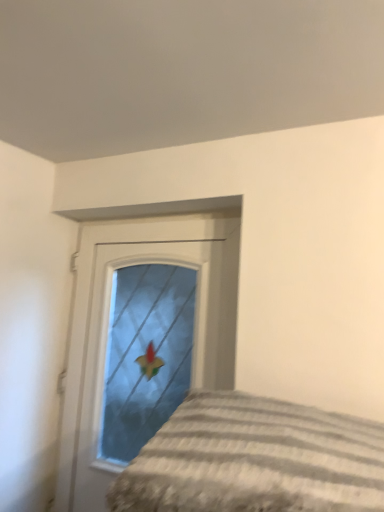
Image resolution: width=384 pixels, height=512 pixels. What do you see at coordinates (108, 323) in the screenshot? I see `matte glass door at center` at bounding box center [108, 323].

The image size is (384, 512). I want to click on matte glass door at center, so click(x=108, y=323).

What do you see at coordinates (254, 459) in the screenshot? The width and height of the screenshot is (384, 512). I see `striped fabric bed at lower right` at bounding box center [254, 459].

Where is `striped fabric bed at lower right`? Image resolution: width=384 pixels, height=512 pixels. striped fabric bed at lower right is located at coordinates (254, 459).

Where is `matte glass door at center`? matte glass door at center is located at coordinates (108, 323).

Does matte glass door at center appear on the right side of striped fabric bed at lower right?

In fact, matte glass door at center is to the left of striped fabric bed at lower right.

Which object is closer to the camera, matte glass door at center or striped fabric bed at lower right?

striped fabric bed at lower right is in front.

Does point (81, 272) come in front of point (248, 433)?

No.

From the image's perspective, is matte glass door at center located above striped fabric bed at lower right?

No, from the image's perspective, matte glass door at center is not on top of striped fabric bed at lower right.

From a real-world perspective, is matte glass door at center positioned above or below striped fabric bed at lower right?

From a real-world perspective, matte glass door at center is physically above striped fabric bed at lower right.

Considering the sizes of objects matte glass door at center and striped fabric bed at lower right in the image provided, who is thinner, matte glass door at center or striped fabric bed at lower right?

matte glass door at center is thinner.

Is matte glass door at center taller or shorter than striped fabric bed at lower right?

Considering their sizes, matte glass door at center has more height than striped fabric bed at lower right.

Based on their sizes in the image, would you say matte glass door at center is bigger or smaller than striped fabric bed at lower right?

In the image, matte glass door at center appears to be larger than striped fabric bed at lower right.

Looking at this image, can we say matte glass door at center lies outside striped fabric bed at lower right?

Yes, matte glass door at center is not within striped fabric bed at lower right.

Is matte glass door at center directly adjacent to striped fabric bed at lower right?

No, matte glass door at center is not with striped fabric bed at lower right.

Is matte glass door at center facing towards striped fabric bed at lower right?

No, matte glass door at center is not turned towards striped fabric bed at lower right.

This screenshot has width=384, height=512. I want to click on door that is above the striped fabric bed at lower right (from a real-world perspective), so point(108,323).

Considering the positions of objects striped fabric bed at lower right and matte glass door at center in the image provided, who is more to the right, striped fabric bed at lower right or matte glass door at center?

From the viewer's perspective, striped fabric bed at lower right appears more on the right side.

Which object is closer to the camera, striped fabric bed at lower right or matte glass door at center?

striped fabric bed at lower right is more forward.

Considering the points (380, 455) and (215, 211), which point is in front, point (380, 455) or point (215, 211)?

The point (380, 455) is closer.

From the image's perspective, does striped fabric bed at lower right appear lower than matte glass door at center?

No.

In the scene shown: From a real-world perspective, which is physically above, striped fabric bed at lower right or matte glass door at center?

matte glass door at center.

From the picture: Is striped fabric bed at lower right wider than matte glass door at center?

Correct, the width of striped fabric bed at lower right exceeds that of matte glass door at center.

Between striped fabric bed at lower right and matte glass door at center, which one has more height?

matte glass door at center.

Considering the sizes of objects striped fabric bed at lower right and matte glass door at center in the image provided, who is smaller, striped fabric bed at lower right or matte glass door at center?

striped fabric bed at lower right is smaller.

Is striped fabric bed at lower right not within matte glass door at center?

Yes, striped fabric bed at lower right is outside of matte glass door at center.

Is striped fabric bed at lower right not close to matte glass door at center?

No, there isn't a large distance between striped fabric bed at lower right and matte glass door at center.

Is striped fabric bed at lower right oriented away from matte glass door at center?

No, matte glass door at center is not at the back of striped fabric bed at lower right.

What's the angular difference between striped fabric bed at lower right and matte glass door at center's facing directions?

They differ by 0.671 degrees in their facing directions.

Where is `bed above the matte glass door at center (from the image's perspective)`? Image resolution: width=384 pixels, height=512 pixels. bed above the matte glass door at center (from the image's perspective) is located at coordinates (254, 459).

Image resolution: width=384 pixels, height=512 pixels. In order to click on door below the striped fabric bed at lower right (from the image's perspective) in this screenshot , I will do `click(108, 323)`.

Where is `bed in front of the matte glass door at center`? The width and height of the screenshot is (384, 512). bed in front of the matte glass door at center is located at coordinates (254, 459).